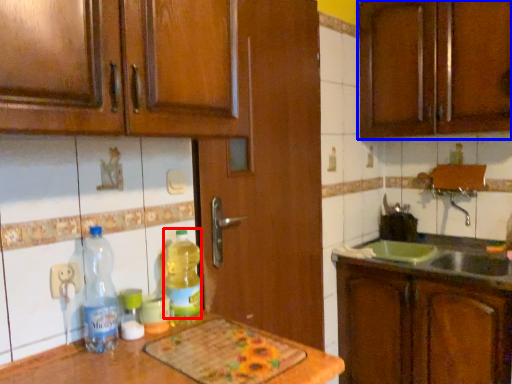
Question: Which of the following is the closest to the observer, bottle (highlighted by a red box) or cabinetry (highlighted by a blue box)?

Choices:
 (A) bottle
 (B) cabinetry

Answer: (A)